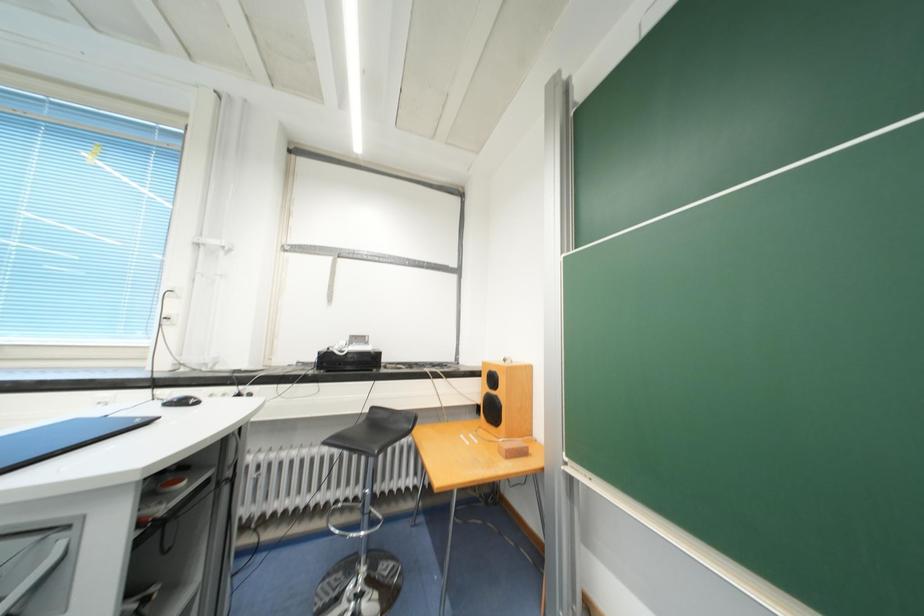
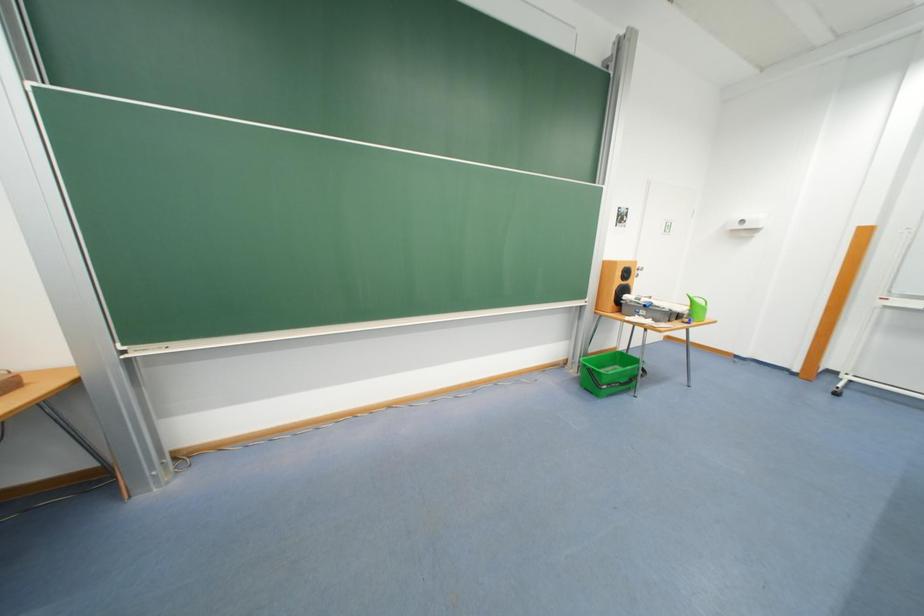
The first image is from the beginning of the video and the second image is from the end. How did the camera likely rotate when shooting the video?

The rotation direction of the camera is right-down.